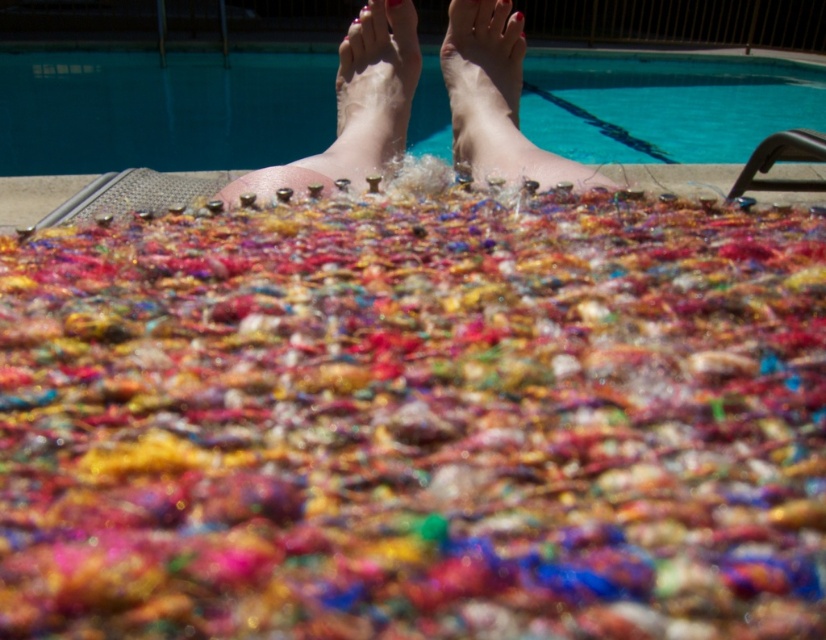
Question: Does matte skin foot at center have a larger size compared to nail polish toes at upper center?

Choices:
 (A) yes
 (B) no

Answer: (B)

Question: Which object is the closest to the blue glossy water at upper center?

Choices:
 (A) matte skin foot at center
 (B) shiny multicolored fabric at center
 (C) nail polish feet at upper center
 (D) matte pink nail at center

Answer: (B)

Question: Which of the following is the closest to the observer?

Choices:
 (A) (55, 525)
 (B) (710, 84)
 (C) (393, 4)
 (D) (414, 72)

Answer: (A)

Question: Does nail polish feet at upper center appear under matte skin foot at center?

Choices:
 (A) yes
 (B) no

Answer: (B)

Question: Among these objects, which one is farthest from the camera?

Choices:
 (A) nail polish feet at upper center
 (B) nail polish toes at upper center

Answer: (B)

Question: Does shiny multicolored fabric at center appear over nail polish feet at upper center?

Choices:
 (A) yes
 (B) no

Answer: (B)